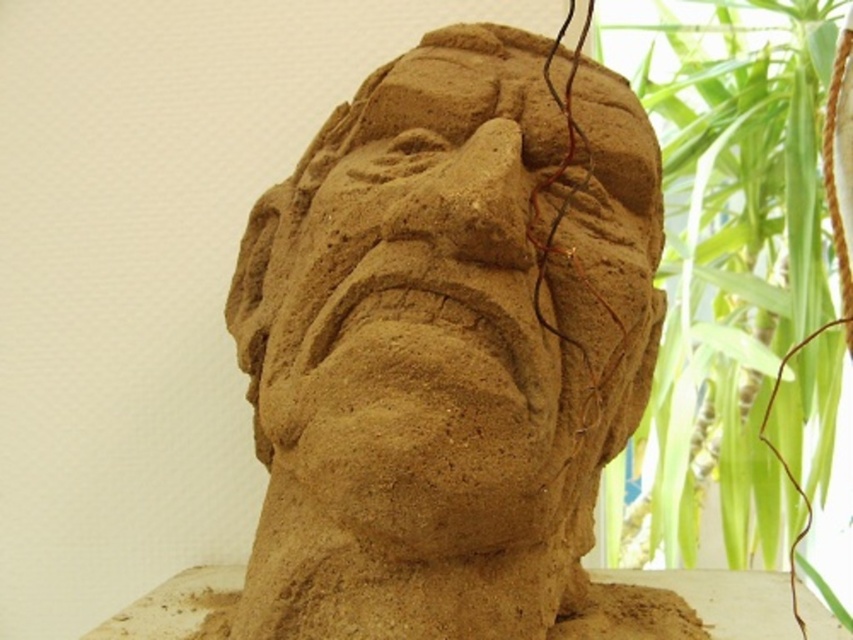
Can you confirm if brown sand sculpture at center is positioned to the right of green leafy plant at upper right?

In fact, brown sand sculpture at center is to the left of green leafy plant at upper right.

Does point (427, 522) lie behind point (728, 44)?

No, it is not.

Where is `brown sand sculpture at center`? The height and width of the screenshot is (640, 853). brown sand sculpture at center is located at coordinates (459, 259).